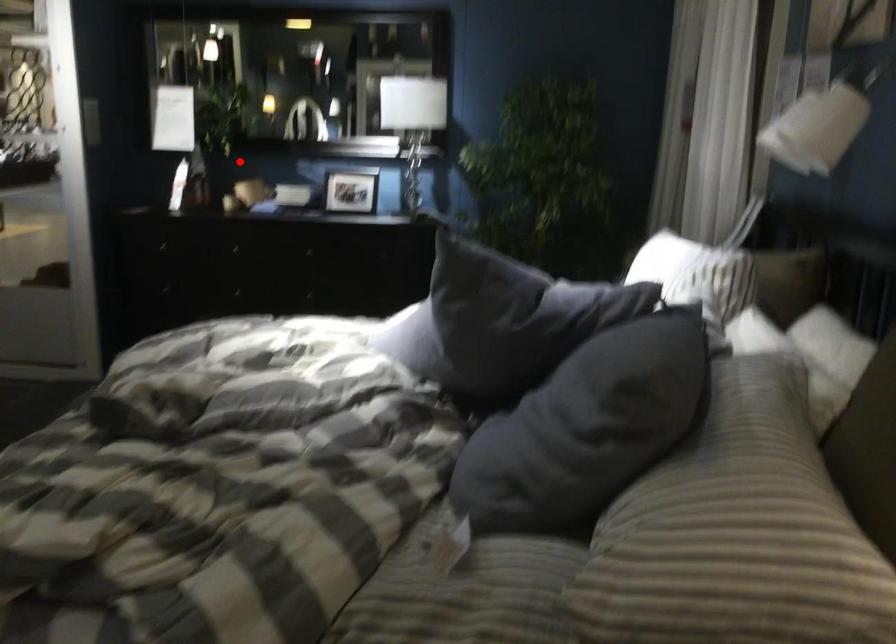
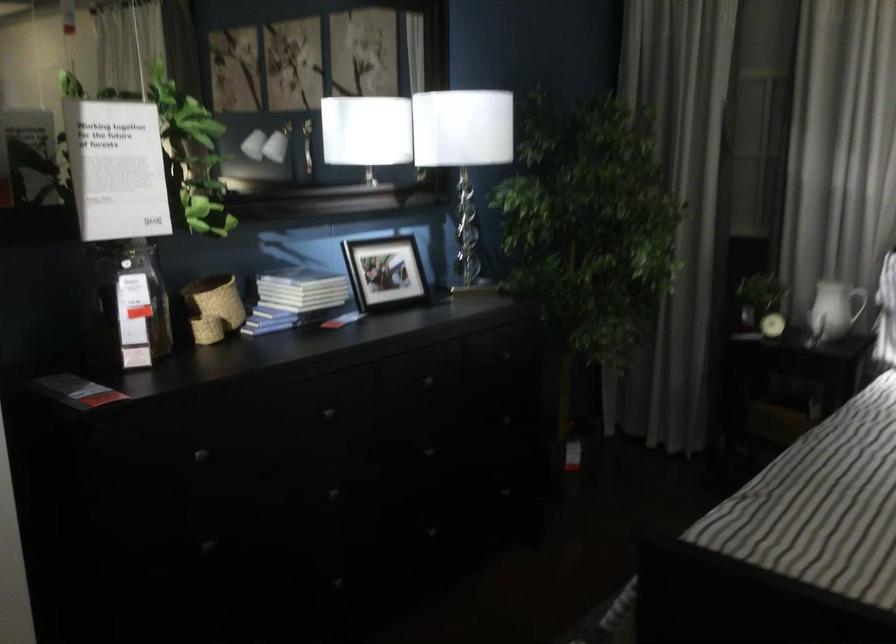
Question: I am providing you with two images of the same scene from different viewpoints. Image1 has a red point marked. In image2, the corresponding 3D location appears at what relative position? Reply with the corresponding letter.

Choices:
 (A) Closer
 (B) Farther

Answer: (A)